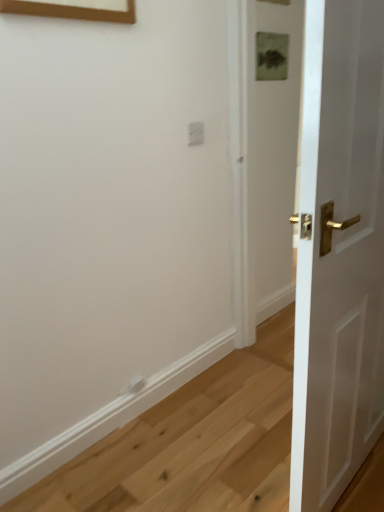
Question: From their relative heights in the image, would you say white glossy door at right is taller or shorter than white plastic electric outlet at upper center?

Choices:
 (A) short
 (B) tall

Answer: (B)

Question: Visually, is white glossy door at right positioned to the left or to the right of white plastic electric outlet at upper center?

Choices:
 (A) left
 (B) right

Answer: (B)

Question: Choose the correct answer: Is white glossy door at right inside white plastic electric outlet at upper center or outside it?

Choices:
 (A) outside
 (B) inside

Answer: (A)

Question: In the image, is white plastic electric outlet at upper center positioned in front of or behind white glossy door at right?

Choices:
 (A) front
 (B) behind

Answer: (B)

Question: In terms of size, does white plastic electric outlet at upper center appear bigger or smaller than white glossy door at right?

Choices:
 (A) small
 (B) big

Answer: (A)

Question: Which is correct: white plastic electric outlet at upper center is inside white glossy door at right, or outside of it?

Choices:
 (A) outside
 (B) inside

Answer: (A)

Question: From a real-world perspective, is white plastic electric outlet at upper center physically located above or below white glossy door at right?

Choices:
 (A) below
 (B) above

Answer: (B)